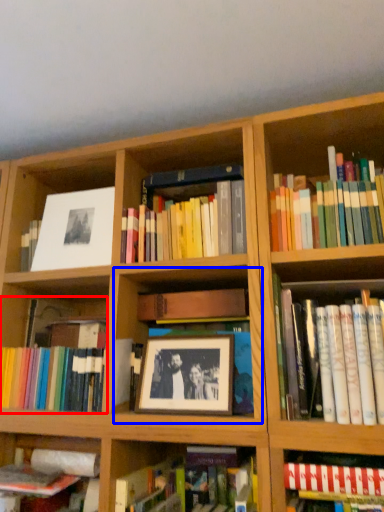
Question: Among these objects, which one is nearest to the camera, book (highlighted by a red box) or cabinet (highlighted by a blue box)?

Choices:
 (A) book
 (B) cabinet

Answer: (B)